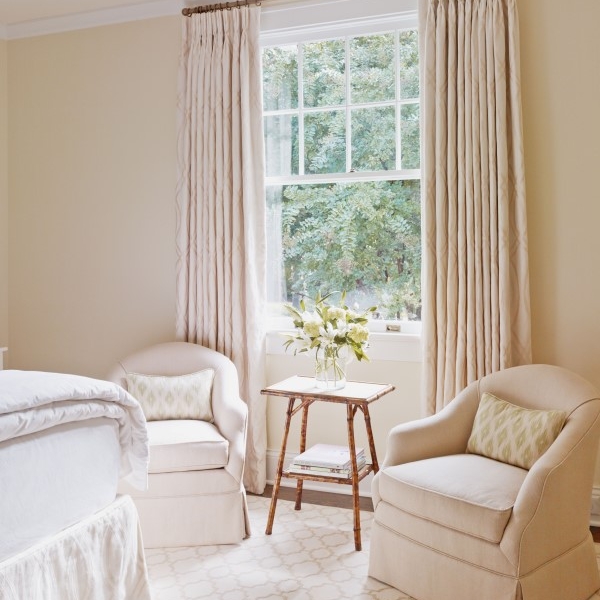
Identify the location of bamboo side table. The image size is (600, 600). (322, 396).